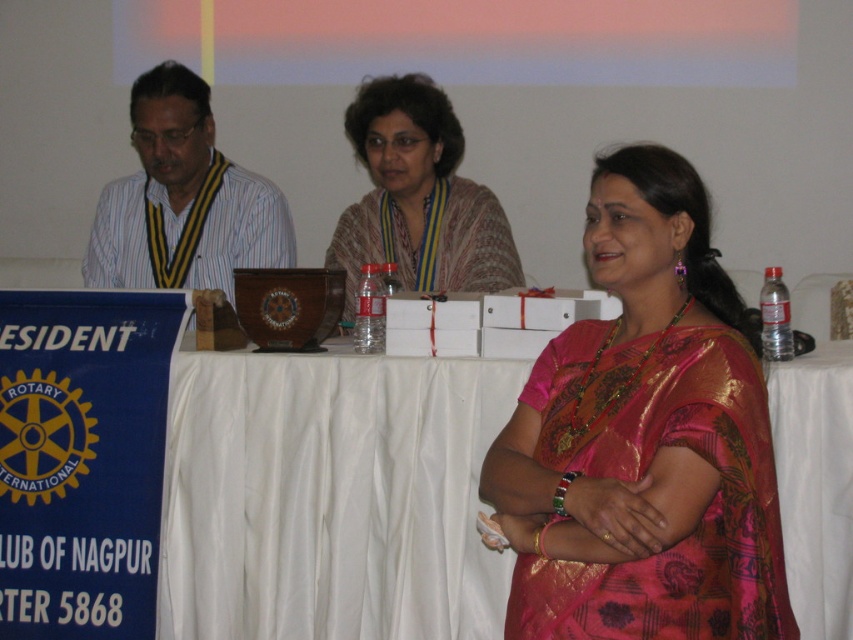
You are a photographer at the Rotary Club event. You want to capture a photo that includes both the pink silk saree at center and the striped shirt at left. What is the minimum distance you need to move backward to ensure both are in frame?

The pink silk saree at center and striped shirt at left are 1.73 meters apart from each other. To include both in the frame, you need to move backward until your camera can cover at least 1.73 meters of the scene.

You are a photographer at the Rotary Club meeting and want to capture the woman in the pink silk saree at center and the patterned fabric shawl at center. Which of the two items is narrower in width?

The pink silk saree at center is thinner than the patterned fabric shawl at center, so the pink silk saree at center is narrower in width.

You are a photographer at the Rotary Club meeting. You need to capture a photo of the woman wearing the pink silk saree at center and the patterned fabric shawl at center. Which item is positioned lower on her body?

The pink silk saree at center is located below the patterned fabric shawl at center, so the pink silk saree at center is positioned lower on her body.